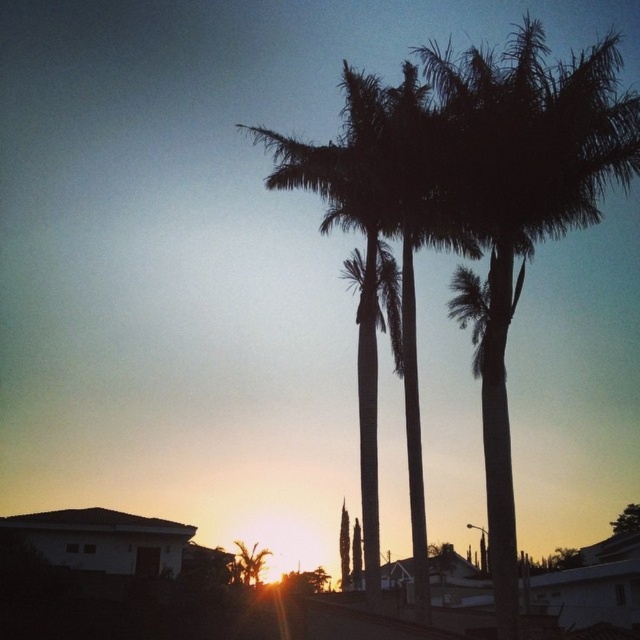
Question: Is silhouette leafy palm at upper center above green leafy tree at upper center?

Choices:
 (A) yes
 (B) no

Answer: (A)

Question: Which point is closer to the camera?

Choices:
 (A) silhouette leafy palm at upper center
 (B) green leafy tree at upper center

Answer: (A)

Question: Among these points, which one is nearest to the camera?

Choices:
 (A) (576, 54)
 (B) (634, 528)

Answer: (B)

Question: Can you confirm if silhouette leafy palm at upper center is positioned above green leafy tree at upper center?

Choices:
 (A) yes
 (B) no

Answer: (A)

Question: Does silhouette leafy palm at upper center appear over green leafy tree at upper center?

Choices:
 (A) yes
 (B) no

Answer: (A)